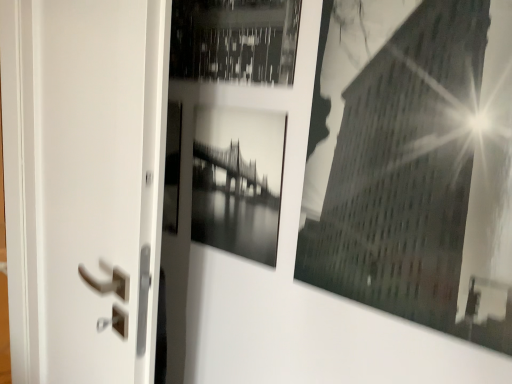
Question: Which direction should I rotate to face black glossy photo frame at center, arranged as the first picture frame when viewed from the left, — up or down?

Choices:
 (A) up
 (B) down

Answer: (A)

Question: Is there a large distance between white matte screen door at left and black glossy photo frame at center, arranged as the first picture frame when viewed from the left?

Choices:
 (A) yes
 (B) no

Answer: (B)

Question: Is white matte screen door at left in contact with black glossy photo frame at center, which appears as the second picture frame when viewed from the right?

Choices:
 (A) yes
 (B) no

Answer: (B)

Question: Is white matte screen door at left not inside black glossy photo frame at center, which appears as the second picture frame when viewed from the right?

Choices:
 (A) yes
 (B) no

Answer: (A)

Question: Considering the relative sizes of white matte screen door at left and black glossy photo frame at center, which appears as the second picture frame when viewed from the right, in the image provided, is white matte screen door at left thinner than black glossy photo frame at center, which appears as the second picture frame when viewed from the right,?

Choices:
 (A) no
 (B) yes

Answer: (A)

Question: Does white matte screen door at left have a greater width compared to black glossy photo frame at center, arranged as the first picture frame when viewed from the left?

Choices:
 (A) yes
 (B) no

Answer: (A)

Question: From a real-world perspective, is white matte screen door at left located higher than black glossy photo frame at center, arranged as the first picture frame when viewed from the left?

Choices:
 (A) no
 (B) yes

Answer: (A)

Question: Is black glossy building at upper right, which ranks as the second picture frame in left-to-right order, oriented towards black glossy photo frame at center, arranged as the first picture frame when viewed from the left?

Choices:
 (A) yes
 (B) no

Answer: (B)

Question: Is black glossy building at upper right, which ranks as the second picture frame in left-to-right order, wider than black glossy photo frame at center, arranged as the first picture frame when viewed from the left?

Choices:
 (A) no
 (B) yes

Answer: (B)

Question: Can you confirm if black glossy building at upper right, the 1th picture frame viewed from the right, is taller than black glossy photo frame at center, which appears as the second picture frame when viewed from the right?

Choices:
 (A) no
 (B) yes

Answer: (B)

Question: Is black glossy building at upper right, which ranks as the second picture frame in left-to-right order, bigger than black glossy photo frame at center, which appears as the second picture frame when viewed from the right?

Choices:
 (A) yes
 (B) no

Answer: (A)

Question: From a real-world perspective, is black glossy building at upper right, the 1th picture frame viewed from the right, positioned under black glossy photo frame at center, which appears as the second picture frame when viewed from the right, based on gravity?

Choices:
 (A) yes
 (B) no

Answer: (B)

Question: Does black glossy building at upper right, which ranks as the second picture frame in left-to-right order, appear on the right side of black glossy photo frame at center, which appears as the second picture frame when viewed from the right?

Choices:
 (A) yes
 (B) no

Answer: (A)

Question: Is the depth of black glossy photo frame at center, which appears as the second picture frame when viewed from the right, greater than that of white matte screen door at left?

Choices:
 (A) yes
 (B) no

Answer: (A)